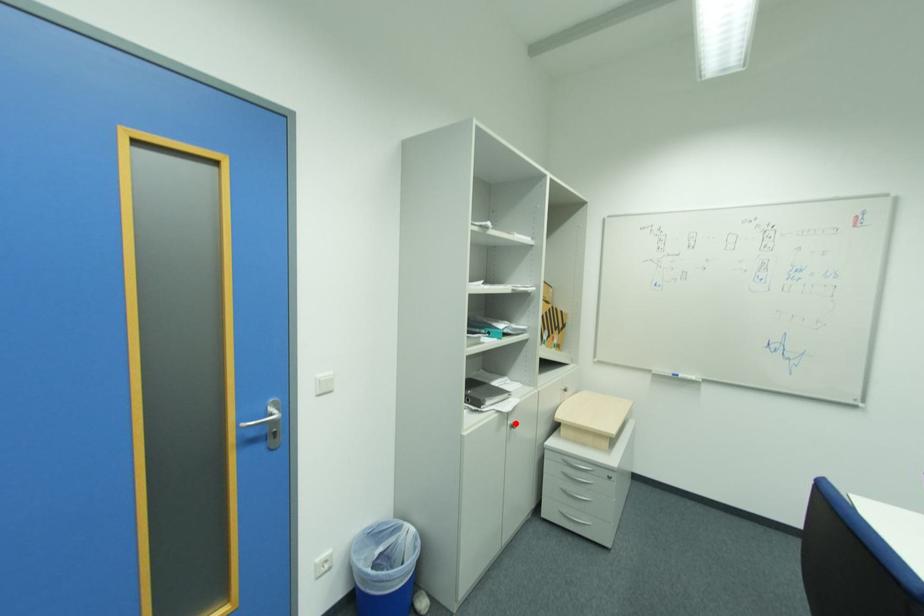
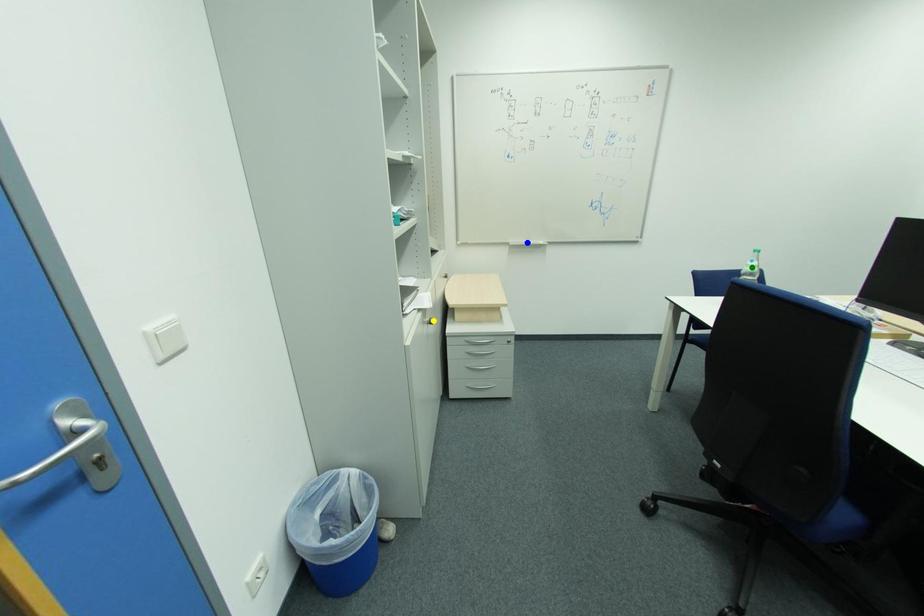
Question: I am providing you with two images of the same scene from different viewpoints. A red point is marked on the first image. You are given multiple points on the second image. Can you choose the point in image 2 that corresponds to the point in image 1?

Choices:
 (A) blue point
 (B) green point
 (C) yellow point

Answer: (C)